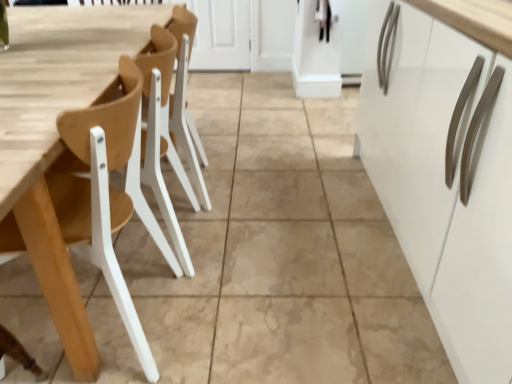
This screenshot has width=512, height=384. Find the location of `natural wood table at left`. natural wood table at left is located at coordinates (58, 77).

The width and height of the screenshot is (512, 384). Describe the element at coordinates (58, 77) in the screenshot. I see `natural wood table at left` at that location.

Find the location of a particular element. wooden chair at left is located at coordinates (97, 250).

Image resolution: width=512 pixels, height=384 pixels. What do you see at coordinates (97, 250) in the screenshot? I see `wooden chair at left` at bounding box center [97, 250].

You are a GUI agent. You are given a task and a screenshot of the screen. Output one action in this format:
    pyautogui.click(x=<x>, y=<y>)
    Task: Click on the natural wood table at left
    The height and width of the screenshot is (384, 512).
    Given the screenshot: What is the action you would take?
    pyautogui.click(x=58, y=77)

In the image, is natural wood table at left on the left side or the right side of wooden chair at left?

In the image, natural wood table at left appears on the right side of wooden chair at left.

Considering the positions of objects natural wood table at left and wooden chair at left in the image provided, who is behind, natural wood table at left or wooden chair at left?

natural wood table at left is behind.

From the picture: Which point is more distant from viewer, (99, 58) or (93, 244)?

The point (99, 58) is farther from the camera.

From the image's perspective, is natural wood table at left over wooden chair at left?

Correct, natural wood table at left appears higher than wooden chair at left in the image.

From a real-world perspective, who is located lower, natural wood table at left or wooden chair at left?

In real-world perspective, natural wood table at left is lower.

Which of these two, natural wood table at left or wooden chair at left, is wider?

wooden chair at left is wider.

Which of these two, natural wood table at left or wooden chair at left, stands taller?

wooden chair at left is taller.

Considering the sizes of objects natural wood table at left and wooden chair at left in the image provided, who is smaller, natural wood table at left or wooden chair at left?

Smaller between the two is natural wood table at left.

Can we say natural wood table at left lies outside wooden chair at left?

natural wood table at left lies outside wooden chair at left's area.

Is natural wood table at left far from wooden chair at left?

No, natural wood table at left is not far from wooden chair at left.

Does natural wood table at left turn towards wooden chair at left?

No, natural wood table at left is not aimed at wooden chair at left.

How many degrees apart are the facing directions of natural wood table at left and wooden chair at left?

The angular difference between natural wood table at left and wooden chair at left is 3.28 degrees.

You are a GUI agent. You are given a task and a screenshot of the screen. Output one action in this format:
    pyautogui.click(x=<x>, y=<y>)
    Task: Click on the table above the wooden chair at left (from the image's perspective)
    
    Given the screenshot: What is the action you would take?
    pyautogui.click(x=58, y=77)

Is wooden chair at left to the right of natural wood table at left from the viewer's perspective?

No.

Does wooden chair at left come in front of natural wood table at left?

Yes, the depth of wooden chair at left is less than that of natural wood table at left.

Considering the positions of points (75, 206) and (96, 36), is point (75, 206) farther from camera compared to point (96, 36)?

No, (75, 206) is in front of (96, 36).

From the image's perspective, is wooden chair at left under natural wood table at left?

Yes.

From a real-world perspective, which object stands above the other?

From a 3D spatial view, wooden chair at left is above.

Which object is wider, wooden chair at left or natural wood table at left?

With larger width is wooden chair at left.

Who is taller, wooden chair at left or natural wood table at left?

Standing taller between the two is wooden chair at left.

Considering the relative sizes of wooden chair at left and natural wood table at left in the image provided, is wooden chair at left bigger than natural wood table at left?

Yes, wooden chair at left is bigger than natural wood table at left.

Is wooden chair at left outside of natural wood table at left?

wooden chair at left is positioned outside natural wood table at left.

Is wooden chair at left next to natural wood table at left and touching it?

No, wooden chair at left is not next to natural wood table at left.

Is wooden chair at left facing towards natural wood table at left?

No, wooden chair at left is not facing towards natural wood table at left.

How different are the orientations of wooden chair at left and natural wood table at left in degrees?

The angle between the facing direction of wooden chair at left and the facing direction of natural wood table at left is 3.28 degrees.

How much distance is there between wooden chair at left and natural wood table at left?

A distance of 15.75 inches exists between wooden chair at left and natural wood table at left.

I want to click on chair that appears on the left of natural wood table at left, so [x=97, y=250].

This screenshot has width=512, height=384. In order to click on table above the wooden chair at left (from the image's perspective) in this screenshot , I will do `click(58, 77)`.

At what (x,y) coordinates should I click in order to perform the action: click on chair below the natural wood table at left (from the image's perspective). Please return your answer as a coordinate pair (x, y). This screenshot has width=512, height=384. Looking at the image, I should click on (97, 250).